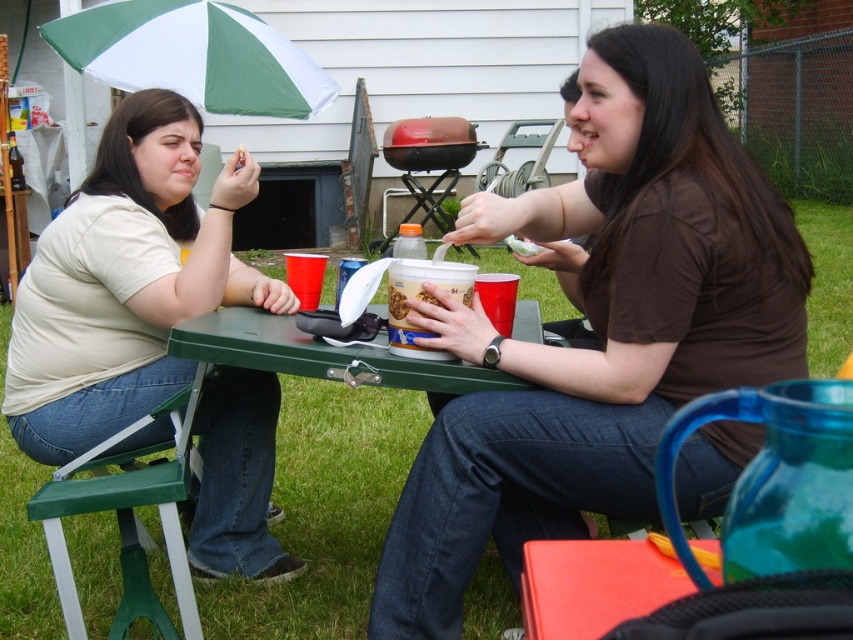
Between brown matte shirt at center and green plastic picnic table at center, which one is positioned higher?

brown matte shirt at center

Does brown matte shirt at center appear under green plastic picnic table at center?

Actually, brown matte shirt at center is above green plastic picnic table at center.

Locate an element on the screen. brown matte shirt at center is located at coordinates pos(599,330).

Image resolution: width=853 pixels, height=640 pixels. I want to click on brown matte shirt at center, so [599, 330].

What do you see at coordinates (599, 330) in the screenshot? This screenshot has width=853, height=640. I see `brown matte shirt at center` at bounding box center [599, 330].

I want to click on brown matte shirt at center, so click(599, 330).

Does green plastic picnic table at center have a greater width compared to smooth plastic container at center?

Indeed, green plastic picnic table at center has a greater width compared to smooth plastic container at center.

Find the location of a particular element. green plastic picnic table at center is located at coordinates (334, 448).

Is point (358, 384) less distant than point (393, 312)?

Yes, point (358, 384) is closer to viewer.

You are a GUI agent. You are given a task and a screenshot of the screen. Output one action in this format:
    pyautogui.click(x=<x>, y=<y>)
    Task: Click on the green plastic picnic table at center
    
    Given the screenshot: What is the action you would take?
    pyautogui.click(x=334, y=448)